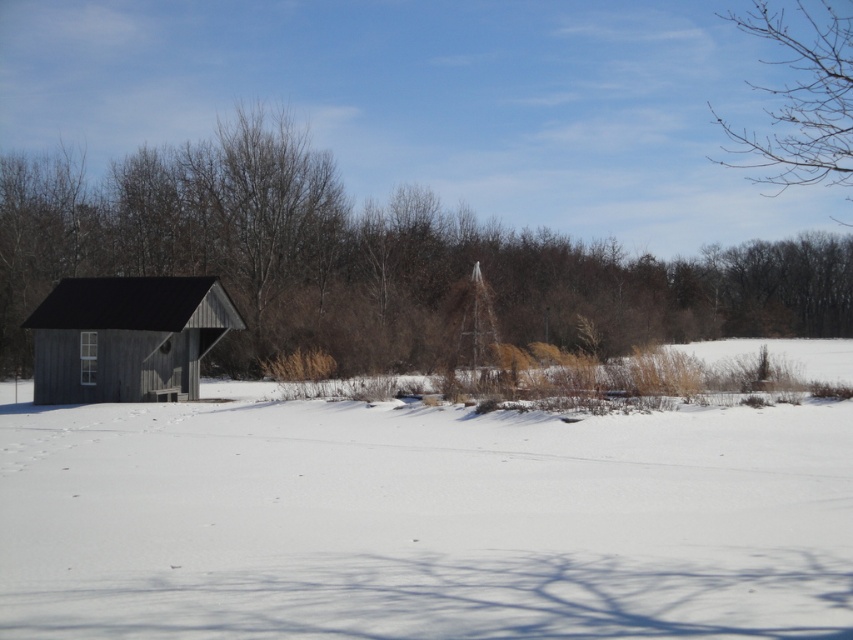
Question: Which is farther from the wooden cabin at left?

Choices:
 (A) bare branches at upper right
 (B) smooth gray wood cabin at left

Answer: (A)

Question: Is the position of white fluffy snow at center more distant than that of smooth gray wood cabin at left?

Choices:
 (A) no
 (B) yes

Answer: (A)

Question: Can you confirm if white fluffy snow at center is bigger than smooth gray wood cabin at left?

Choices:
 (A) yes
 (B) no

Answer: (B)

Question: Can you confirm if white fluffy snow at center is thinner than wooden cabin at left?

Choices:
 (A) yes
 (B) no

Answer: (B)

Question: Which of the following is the farthest from the observer?

Choices:
 (A) white fluffy snow at center
 (B) wooden cabin at left

Answer: (B)

Question: Among these points, which one is farthest from the camera?

Choices:
 (A) (106, 532)
 (B) (196, 292)
 (C) (212, 177)

Answer: (C)